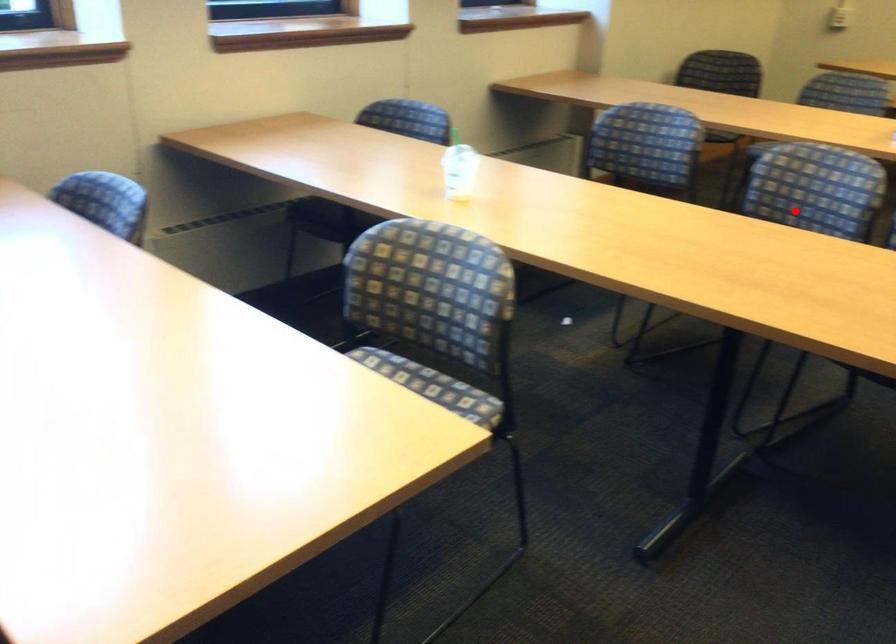
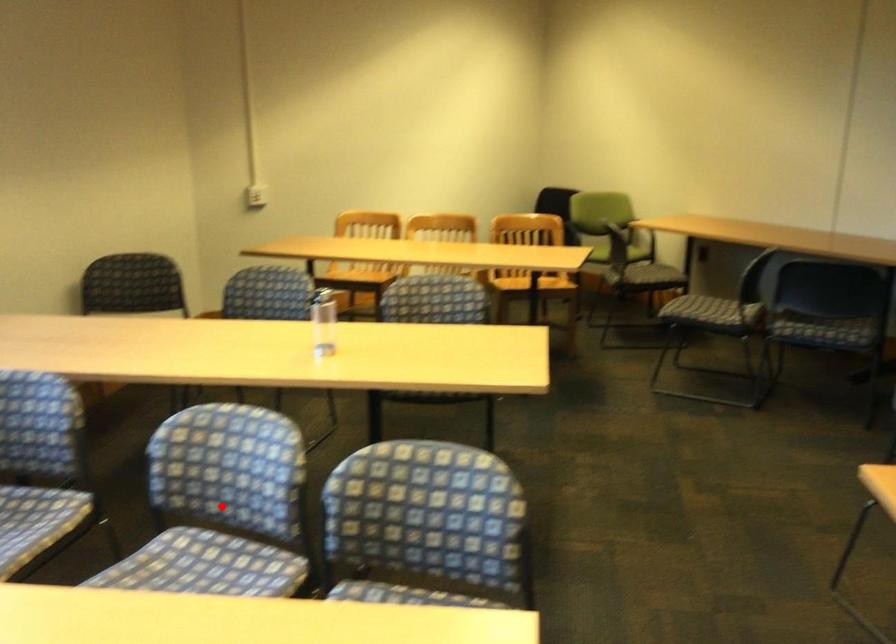
I am providing you with two images of the same scene from different viewpoints. A red point is marked on the first image and another point is marked on the second image. Are the points marked in image1 and image2 representing the same 3D position?

Yes